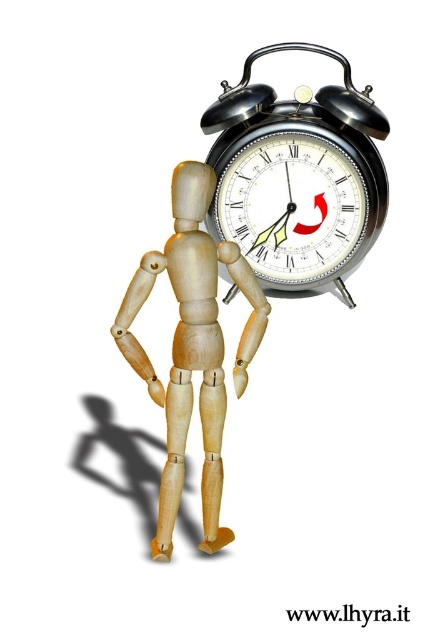
You are an interior designer arranging items in a minimalist room. You have a black metal alarm clock at upper right and a wooden mannequin at center. Which item is wider?

The black metal alarm clock at upper right is wider than the wooden mannequin at center.

You are standing 5 feet away from the wooden mannequin at center. Can you see the details of the mannequin clearly?

The wooden mannequin at center is 31.43 inches away from camera, so yes, you can see the details of the wooden mannequin at center clearly from 5 feet away.